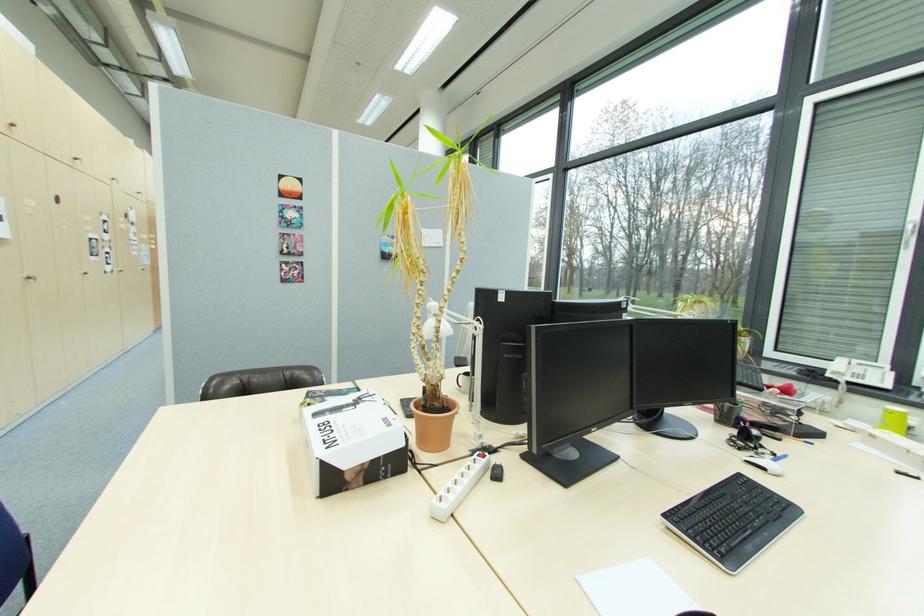
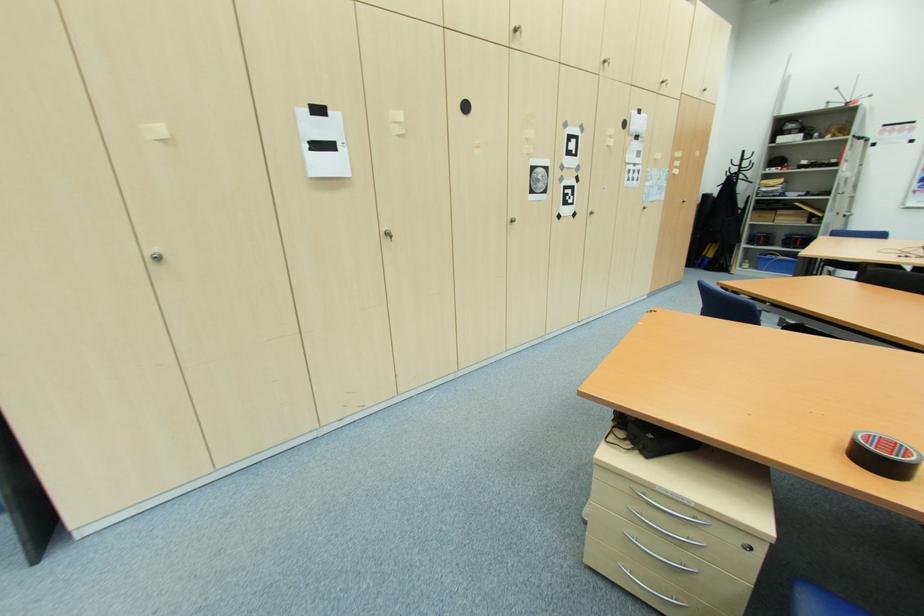
Where in the second image is the point corresponding to point 91,275 from the first image?

(517, 222)